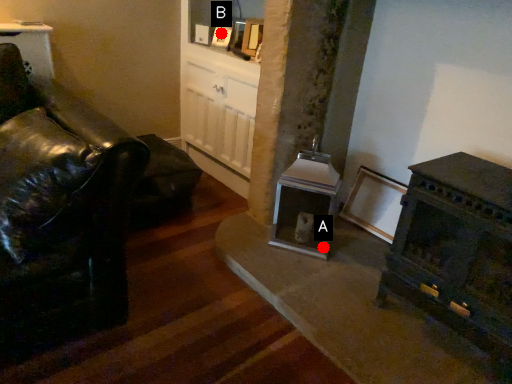
Question: Two points are circled on the image, labeled by A and B beside each circle. Which point is closer to the camera?

Choices:
 (A) A is closer
 (B) B is closer

Answer: (A)